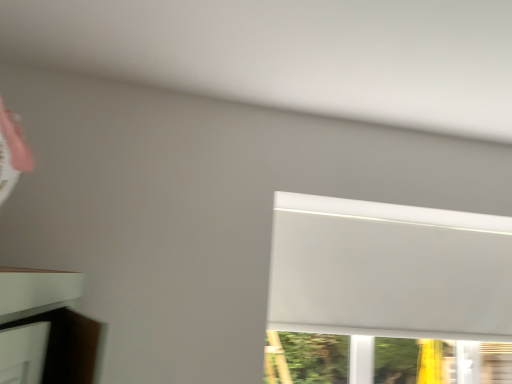
Image resolution: width=512 pixels, height=384 pixels. What do you see at coordinates (387, 294) in the screenshot?
I see `white matte window at upper right` at bounding box center [387, 294].

This screenshot has height=384, width=512. Identify the location of white matte window at upper right. (387, 294).

The height and width of the screenshot is (384, 512). Find the location of `white matte window at upper right`. white matte window at upper right is located at coordinates (387, 294).